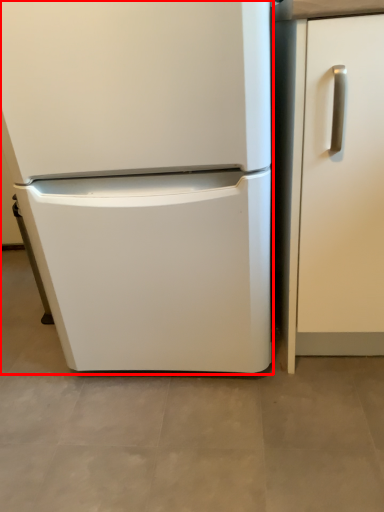
Question: Where is refrigerator (annotated by the red box) located in relation to door in the image?

Choices:
 (A) right
 (B) left

Answer: (B)